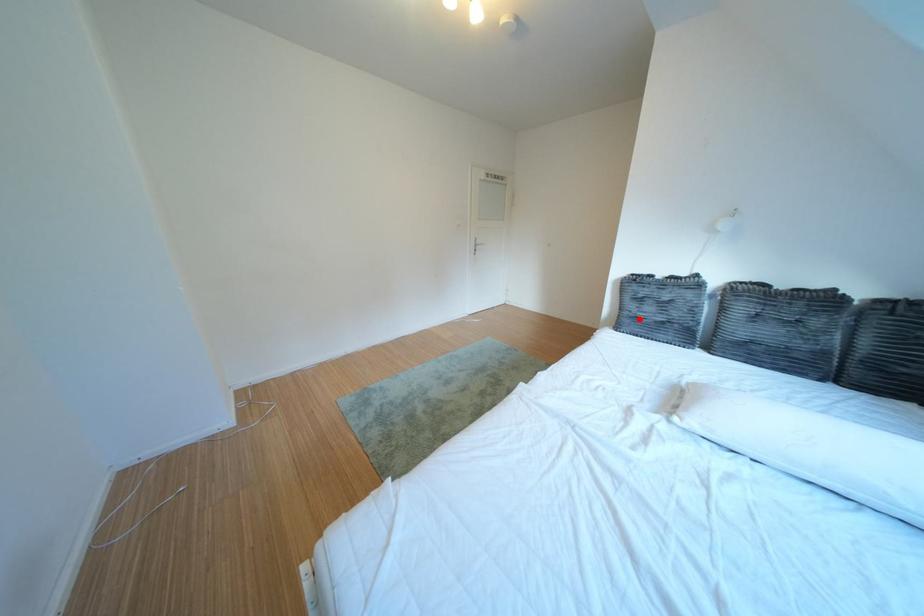
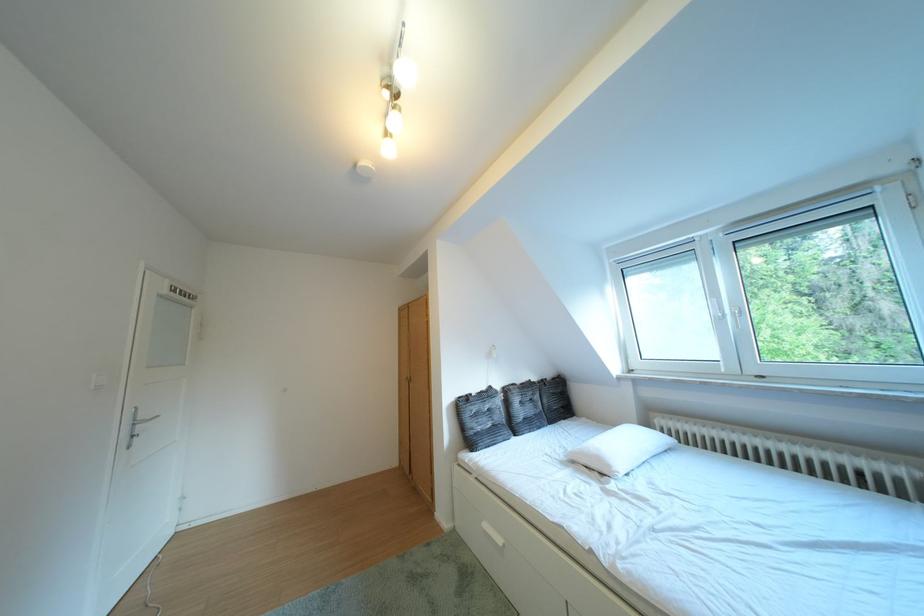
Where in the second image is the point corresponding to the highlighted location from the first image?

(484, 438)